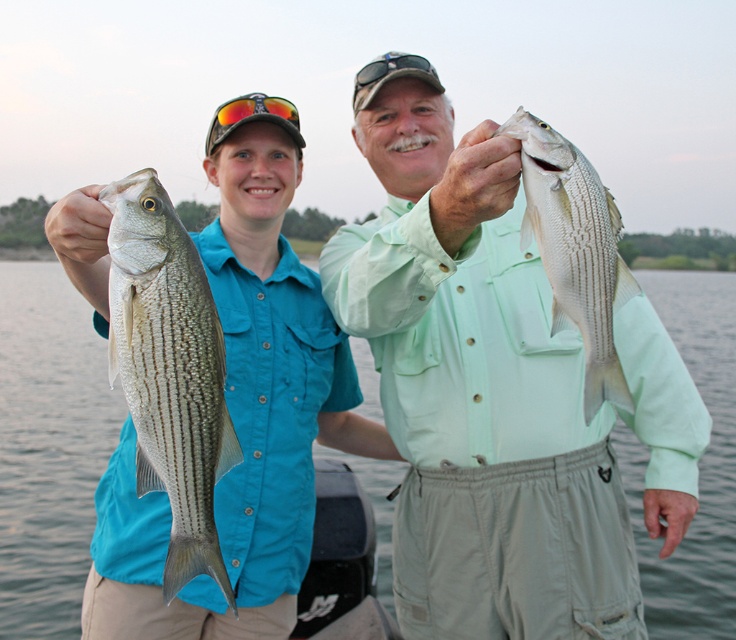
Who is shorter, clear water at center or white striped fish at upper center?

With less height is white striped fish at upper center.

At what (x,y) coordinates should I click in order to perform the action: click on clear water at center. Please return your answer as a coordinate pair (x, y). The image size is (736, 640). Looking at the image, I should click on (49, 448).

Between point (21, 509) and point (517, 131), which one is positioned in front?

Point (517, 131)

Locate an element on the screen. The image size is (736, 640). clear water at center is located at coordinates (49, 448).

Who is higher up, matte green shirt at center or shiny silver fish at left?

matte green shirt at center is above.

Consider the image. Is matte green shirt at center positioned in front of shiny silver fish at left?

No, it is behind shiny silver fish at left.

Which is behind, point (467, 144) or point (174, 248)?

Positioned behind is point (467, 144).

Locate an element on the screen. The image size is (736, 640). matte green shirt at center is located at coordinates click(475, 385).

Which of these two, matte blue shirt at center or shiny silver fish at left, stands shorter?

Standing shorter between the two is shiny silver fish at left.

Between point (268, 541) and point (199, 392), which one is positioned behind?

Point (268, 541)

The width and height of the screenshot is (736, 640). In order to click on matte blue shirt at center in this screenshot , I will do `click(241, 408)`.